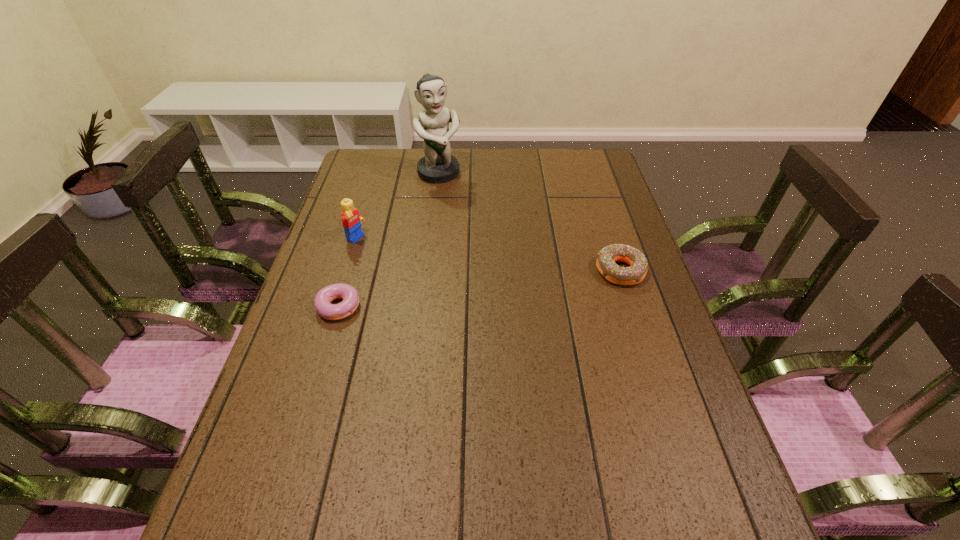
This screenshot has height=540, width=960. Find the location of `vacant area situated on the face of the third nearest object`. vacant area situated on the face of the third nearest object is located at coordinates (469, 297).

The image size is (960, 540). Identify the location of vacant area situated 0.330m on the face of the third nearest object. (453, 289).

Where is `vacant space located 0.140m on the face of the third nearest object`? This screenshot has width=960, height=540. vacant space located 0.140m on the face of the third nearest object is located at coordinates (398, 262).

Locate an element on the screen. The height and width of the screenshot is (540, 960). vacant space situated on the front-facing side of the figurine is located at coordinates (469, 227).

You are a GUI agent. You are given a task and a screenshot of the screen. Output one action in this format:
    pyautogui.click(x=<x>, y=<y>)
    Task: Click on the vacant area situated 0.370m on the front-facing side of the figurine
    
    Given the screenshot: What is the action you would take?
    pyautogui.click(x=485, y=254)

Locate an element on the screen. Image resolution: width=960 pixels, height=540 pixels. vacant space located on the front-facing side of the figurine is located at coordinates (487, 258).

Identify the location of object located in the far edge section of the desktop. (438, 166).

I want to click on doughnut that is at the left edge, so click(323, 299).

The image size is (960, 540). In order to click on Lego at the left edge in this screenshot , I will do `click(351, 220)`.

I want to click on object that is positioned at the right edge, so click(x=606, y=258).